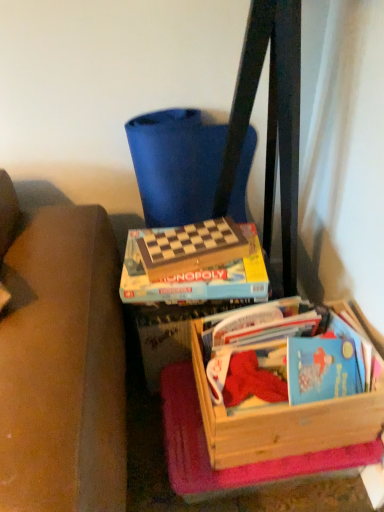
The width and height of the screenshot is (384, 512). Find the location of `blank space situated above wooden crate at lower right (from a real-world perspective)`. blank space situated above wooden crate at lower right (from a real-world perspective) is located at coordinates (284, 358).